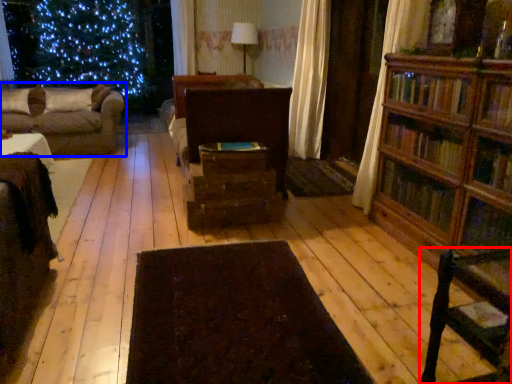
Question: Which of the following is the farthest to the observer, chair (highlighted by a red box) or studio couch (highlighted by a blue box)?

Choices:
 (A) chair
 (B) studio couch

Answer: (B)